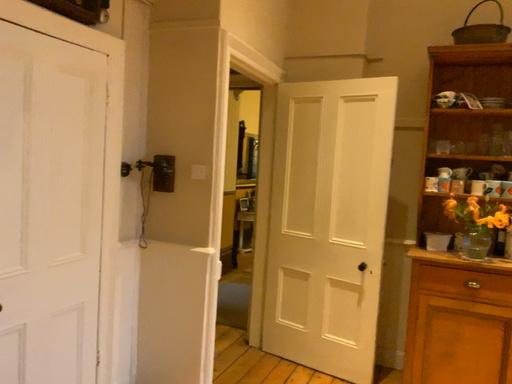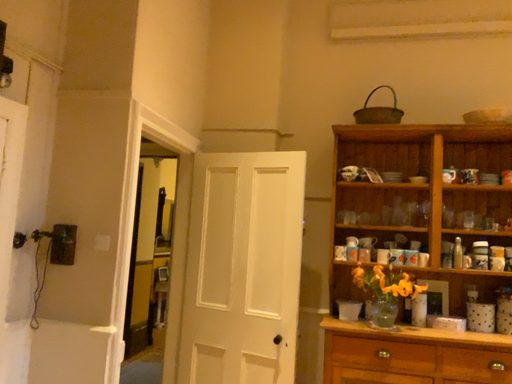
Question: Which way did the camera rotate in the video?

Choices:
 (A) rotated downward
 (B) rotated upward

Answer: (B)